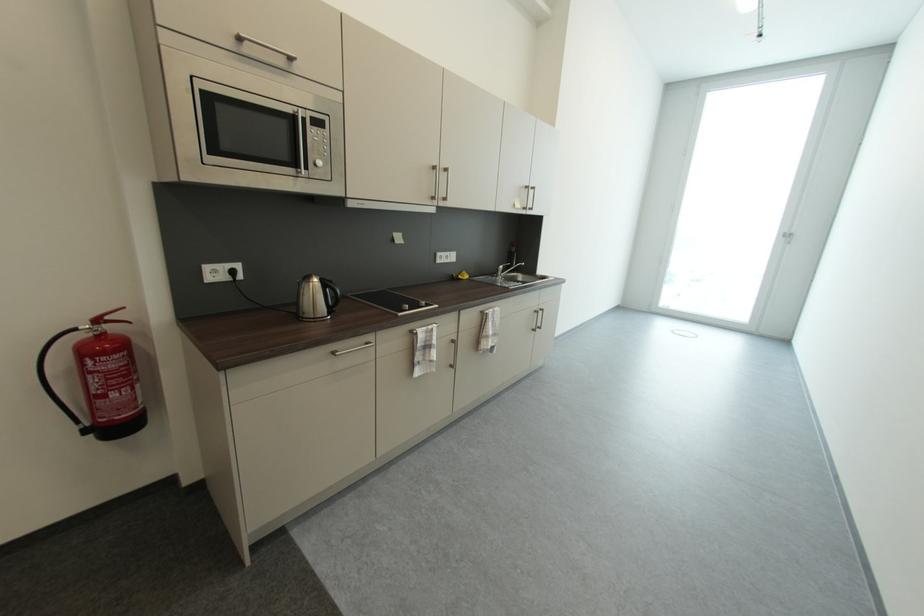
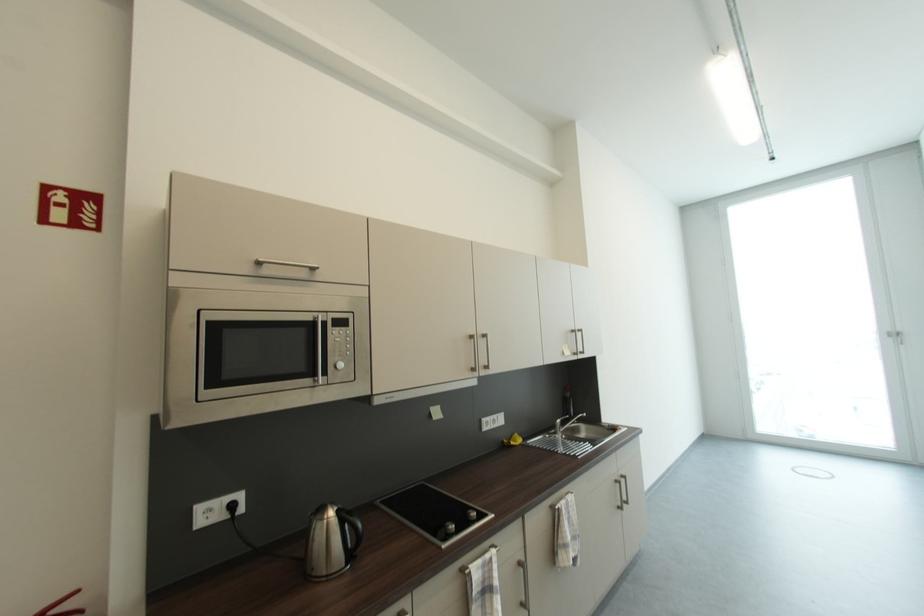
Question: Which direction would the cameraman need to move to produce the second image? Reply with the corresponding letter.

Choices:
 (A) Left
 (B) Right
 (C) Forward
 (D) Backward

Answer: (C)